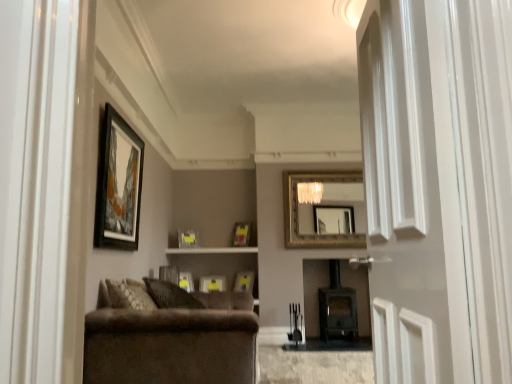
This screenshot has width=512, height=384. Describe the element at coordinates (244, 281) in the screenshot. I see `matte silver picture frame at center, which is the 3th picture frame in front-to-back order` at that location.

At what (x,y) coordinates should I click in order to perform the action: click on matte yellow picture frame at center, placed as the seventh picture frame when sorted from front to back. Please return your answer as a coordinate pair (x, y). The image size is (512, 384). Looking at the image, I should click on (212, 284).

The height and width of the screenshot is (384, 512). What do you see at coordinates (186, 281) in the screenshot?
I see `matte black picture frame at center, the fourth picture frame viewed from the back` at bounding box center [186, 281].

What do you see at coordinates (169, 274) in the screenshot? This screenshot has width=512, height=384. I see `matte black picture frame at center, placed as the second picture frame when sorted from front to back` at bounding box center [169, 274].

Locate an element on the screen. This screenshot has height=384, width=512. matte silver picture frame at center, which is the 5th picture frame in back-to-front order is located at coordinates (244, 281).

Which of these two, wooden picture frame at upper left, placed as the first picture frame when sorted from front to back, or matte yellow picture frame at center, which is counted as the 2th picture frame, starting from the back, is bigger?

With larger size is wooden picture frame at upper left, placed as the first picture frame when sorted from front to back.

How many degrees apart are the facing directions of wooden picture frame at upper left, placed as the first picture frame when sorted from front to back, and matte yellow picture frame at center, which is counted as the 2th picture frame, starting from the back?

The angular difference between wooden picture frame at upper left, placed as the first picture frame when sorted from front to back, and matte yellow picture frame at center, which is counted as the 2th picture frame, starting from the back, is 56.4 degrees.

Which is more to the right, wooden picture frame at upper left, acting as the 7th picture frame starting from the back, or matte yellow picture frame at center, which is counted as the 2th picture frame, starting from the back?

Positioned to the right is matte yellow picture frame at center, which is counted as the 2th picture frame, starting from the back.

Which is in front, wooden picture frame at upper left, acting as the 7th picture frame starting from the back, or matte yellow picture frame at center, which ranks as the 6th picture frame in front-to-back order?

wooden picture frame at upper left, acting as the 7th picture frame starting from the back, is more forward.

In the image, is wooden picture frame at upper left, acting as the 7th picture frame starting from the back, positioned in front of or behind velvet brown couch at lower left?

Clearly, wooden picture frame at upper left, acting as the 7th picture frame starting from the back, is behind velvet brown couch at lower left.

Does wooden picture frame at upper left, placed as the first picture frame when sorted from front to back, have a smaller size compared to velvet brown couch at lower left?

Yes, wooden picture frame at upper left, placed as the first picture frame when sorted from front to back, is smaller than velvet brown couch at lower left.

From a real-world perspective, which is physically below, wooden picture frame at upper left, acting as the 7th picture frame starting from the back, or velvet brown couch at lower left?

velvet brown couch at lower left is physically lower.

Is matte black picture frame at center, which is the 4th picture frame from front to back, turned away from white glossy door at center?

No.

How different are the orientations of matte black picture frame at center, which is the 4th picture frame from front to back, and white glossy door at center in degrees?

matte black picture frame at center, which is the 4th picture frame from front to back, and white glossy door at center are facing 138 degrees away from each other.

Which object is further away from the camera taking this photo, matte black picture frame at center, which is the 4th picture frame from front to back, or white glossy door at center?

matte black picture frame at center, which is the 4th picture frame from front to back, is further away from the camera.

Find the location of `glass door that is in front of the matte black picture frame at center, which is the 4th picture frame from front to back`. glass door that is in front of the matte black picture frame at center, which is the 4th picture frame from front to back is located at coordinates (412, 196).

Does point (95, 226) come closer to viewer compared to point (175, 267)?

Yes, it is.

Between wooden picture frame at upper left, placed as the first picture frame when sorted from front to back, and matte black picture frame at center, placed as the second picture frame when sorted from front to back, which one has smaller size?

matte black picture frame at center, placed as the second picture frame when sorted from front to back.

From a real-world perspective, starting from the wooden picture frame at upper left, placed as the first picture frame when sorted from front to back, which picture frame is the 3rd one below it? Please provide its 2D coordinates.

[(169, 274)]

Between wooden picture frame at upper left, placed as the first picture frame when sorted from front to back, and matte black picture frame at center, which ranks as the sixth picture frame in back-to-front order, which one is positioned in front?

wooden picture frame at upper left, placed as the first picture frame when sorted from front to back, is in front.

Considering the sizes of objects matte yellow picture frame at center, which is counted as the 2th picture frame, starting from the back, and wooden picture frame at upper left, placed as the first picture frame when sorted from front to back, in the image provided, who is smaller, matte yellow picture frame at center, which is counted as the 2th picture frame, starting from the back, or wooden picture frame at upper left, placed as the first picture frame when sorted from front to back,?

With smaller size is matte yellow picture frame at center, which is counted as the 2th picture frame, starting from the back.

Which object is more forward, matte yellow picture frame at center, which ranks as the 6th picture frame in front-to-back order, or wooden picture frame at upper left, acting as the 7th picture frame starting from the back?

Positioned in front is wooden picture frame at upper left, acting as the 7th picture frame starting from the back.

Locate an element on the screen. picture frame that is the 3rd object to the right of the wooden picture frame at upper left, acting as the 7th picture frame starting from the back, starting at the anchor is located at coordinates (188, 239).

From a real-world perspective, who is located lower, matte yellow picture frame at center, which ranks as the 6th picture frame in front-to-back order, or wooden picture frame at upper left, acting as the 7th picture frame starting from the back?

matte yellow picture frame at center, which ranks as the 6th picture frame in front-to-back order, from a real-world perspective.

Is there a large distance between dark brown wood fireplace at center and matte yellow picture frame at center, positioned as the first picture frame in back-to-front order?

Indeed, dark brown wood fireplace at center is not near matte yellow picture frame at center, positioned as the first picture frame in back-to-front order.

The width and height of the screenshot is (512, 384). I want to click on fireplace below the matte yellow picture frame at center, placed as the seventh picture frame when sorted from front to back (from the image's perspective), so click(337, 307).

Does dark brown wood fireplace at center appear on the right side of matte yellow picture frame at center, positioned as the first picture frame in back-to-front order?

Yes.

In terms of size, does dark brown wood fireplace at center appear bigger or smaller than matte yellow picture frame at center, placed as the seventh picture frame when sorted from front to back?

dark brown wood fireplace at center is bigger than matte yellow picture frame at center, placed as the seventh picture frame when sorted from front to back.

From the image's perspective, is matte black picture frame at center, the fourth picture frame viewed from the back, above or below matte yellow picture frame at center, which ranks as the 6th picture frame in front-to-back order?

matte black picture frame at center, the fourth picture frame viewed from the back, is below matte yellow picture frame at center, which ranks as the 6th picture frame in front-to-back order.

How much distance is there between matte black picture frame at center, which is the 4th picture frame from front to back, and matte yellow picture frame at center, which is counted as the 2th picture frame, starting from the back?

They are 18.15 inches apart.

Between matte black picture frame at center, the fourth picture frame viewed from the back, and matte yellow picture frame at center, which is counted as the 2th picture frame, starting from the back, which one has larger width?

With larger width is matte black picture frame at center, the fourth picture frame viewed from the back.

Can you confirm if matte black picture frame at center, which is the 4th picture frame from front to back, is shorter than matte yellow picture frame at center, which is counted as the 2th picture frame, starting from the back?

Incorrect, the height of matte black picture frame at center, which is the 4th picture frame from front to back, does not fall short of that of matte yellow picture frame at center, which is counted as the 2th picture frame, starting from the back.

Locate an element on the screen. The image size is (512, 384). picture frame that is the 2nd one when counting downward from the wooden picture frame at upper left, acting as the 7th picture frame starting from the back (from the image's perspective) is located at coordinates (188, 239).

The width and height of the screenshot is (512, 384). Identify the location of picture frame that is the 5th object to the left of the velvet brown couch at lower left, starting at the anchor. (118, 184).

Considering their positions, is matte yellow picture frame at center, which ranks as the 6th picture frame in front-to-back order, positioned further to matte black picture frame at center, which is the 4th picture frame from front to back, than gold-framed mirror at upper center?

gold-framed mirror at upper center is positioned further to the anchor matte black picture frame at center, which is the 4th picture frame from front to back.

Which object lies nearer to the anchor point matte yellow picture frame at center, which is counted as the 3th picture frame, starting from the back, matte wood shelf at center or gold-framed mirror at upper center?

Based on the image, matte wood shelf at center appears to be nearer to matte yellow picture frame at center, which is counted as the 3th picture frame, starting from the back.

Looking at the image, which one is located closer to matte silver picture frame at center, which is the 5th picture frame in back-to-front order, dark brown wood fireplace at center or matte yellow picture frame at center, placed as the seventh picture frame when sorted from front to back?

matte yellow picture frame at center, placed as the seventh picture frame when sorted from front to back, is closer to matte silver picture frame at center, which is the 5th picture frame in back-to-front order.

Looking at the image, which one is located closer to dark brown wood fireplace at center, wooden picture frame at upper left, placed as the first picture frame when sorted from front to back, or matte yellow picture frame at center, the 5th picture frame viewed from the front?

matte yellow picture frame at center, the 5th picture frame viewed from the front.

Based on their spatial positions, is matte yellow picture frame at center, placed as the seventh picture frame when sorted from front to back, or gold-framed mirror at upper center further from wooden picture frame at upper left, acting as the 7th picture frame starting from the back?

gold-framed mirror at upper center is further to wooden picture frame at upper left, acting as the 7th picture frame starting from the back.

Estimate the real-world distances between objects in this image. Which object is further from matte yellow picture frame at center, which is counted as the 3th picture frame, starting from the back, matte wood shelf at center or matte silver picture frame at center, which is the 5th picture frame in back-to-front order?

matte silver picture frame at center, which is the 5th picture frame in back-to-front order, is positioned further to the anchor matte yellow picture frame at center, which is counted as the 3th picture frame, starting from the back.

Which object lies nearer to the anchor point dark brown wood fireplace at center, white glossy door at center or matte black picture frame at center, placed as the second picture frame when sorted from front to back?

Based on the image, matte black picture frame at center, placed as the second picture frame when sorted from front to back, appears to be nearer to dark brown wood fireplace at center.

From the image, which object appears to be farther from wooden picture frame at upper left, acting as the 7th picture frame starting from the back, matte wood shelf at center or white glossy door at center?

Among the two, matte wood shelf at center is located further to wooden picture frame at upper left, acting as the 7th picture frame starting from the back.

The height and width of the screenshot is (384, 512). In order to click on studio couch between white glossy door at center and matte yellow picture frame at center, which ranks as the 6th picture frame in front-to-back order, from front to back in this screenshot , I will do `click(168, 340)`.

You are a GUI agent. You are given a task and a screenshot of the screen. Output one action in this format:
    pyautogui.click(x=<x>, y=<y>)
    Task: Click on the shelf between white glossy door at center and matte yellow picture frame at center, which ranks as the 6th picture frame in front-to-back order, along the z-axis
    This screenshot has width=512, height=384.
    Given the screenshot: What is the action you would take?
    pyautogui.click(x=213, y=250)

Find the location of a particular element. shelf between matte yellow picture frame at center, which is counted as the 2th picture frame, starting from the back, and gold-framed mirror at upper center from left to right is located at coordinates (213, 250).

The width and height of the screenshot is (512, 384). Identify the location of shelf between matte yellow picture frame at center, which is counted as the 3th picture frame, starting from the back, and matte silver picture frame at center, which is the 3th picture frame in front-to-back order, vertically. (213, 250).